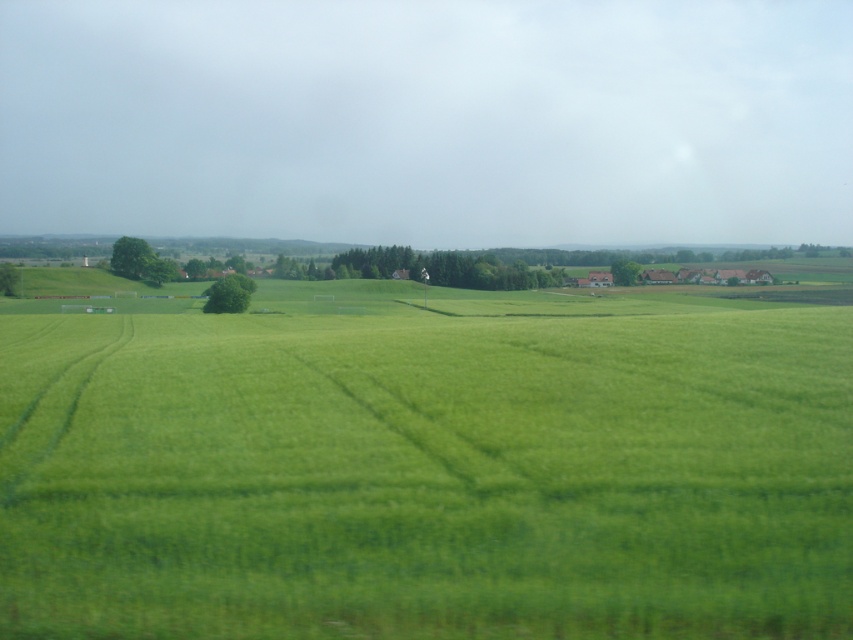
You are a drone operator planning to fly a drone over the green grassy field at center and the green leafy tree at center. Based on their positions, which object would the drone encounter first when flying from the sky downward?

The drone would first encounter the green leafy tree at center because the green grassy field at center is positioned under it, meaning the tree is higher up in the sky relative to the field.

You are standing in the rural landscape described. There is a point marked at coordinates point [144,580]. If you want to reach this point without getting too close to the cluster of buildings with red tiled roofs, which direction should you move relative to your current position?

The point [144,580] is 21.57 feet away from the viewer. Since the cluster of buildings with red tiled roofs is located further back in the image, moving towards the point while staying closer to the foreground areas would keep you away from the buildings. Therefore, you should move forward towards the point while staying near the grassy field and away from the line of trees and buildings.